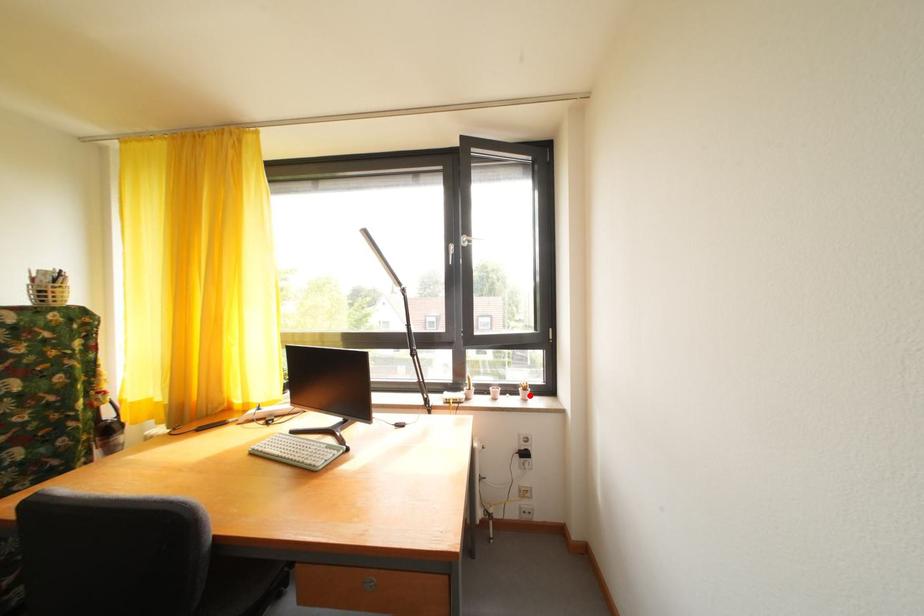
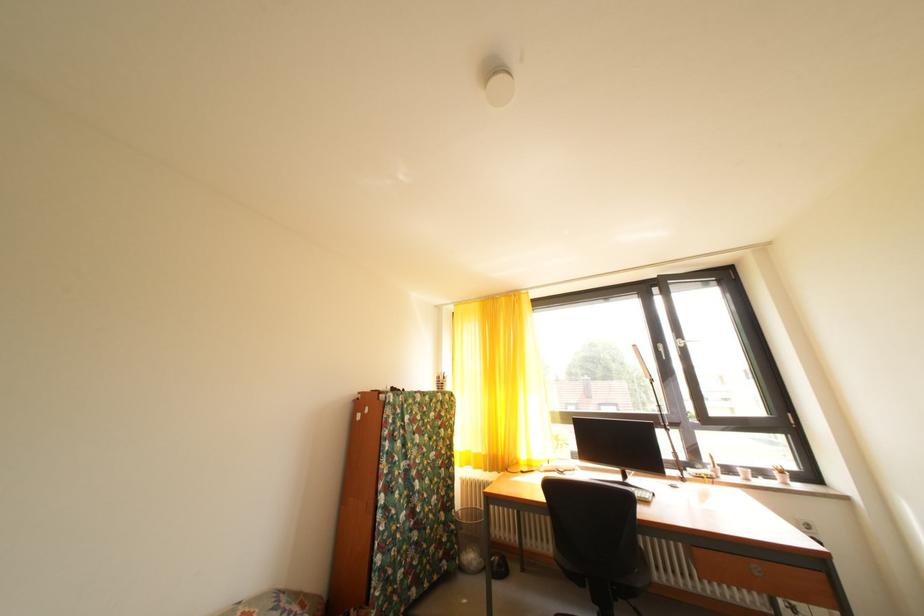
Where in the second image is the point corresponding to the highlighted location from the first image?

(784, 479)